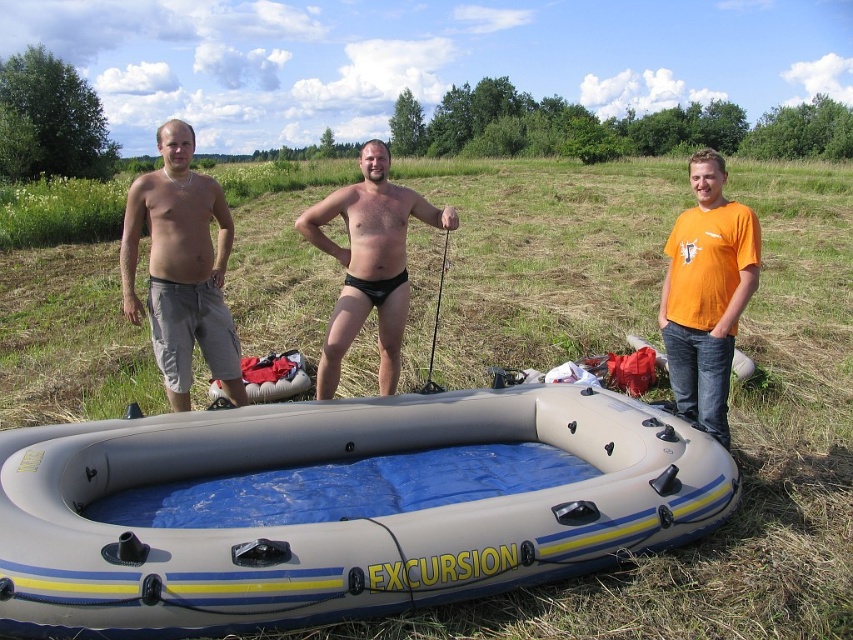
You are planning to take a photo of the scene. You want to ensure that the person with matte gray shorts at left is in focus. Where should you position your camera relative to the inflatable boat labeled EXCURSION? Please provide coordinates in the format of a point within the image frame, such as point (181, 268).

The point (181, 268) indicates the location of the matte gray shorts at left. To ensure the person with matte gray shorts at left is in focus, position the camera at point (181, 268).